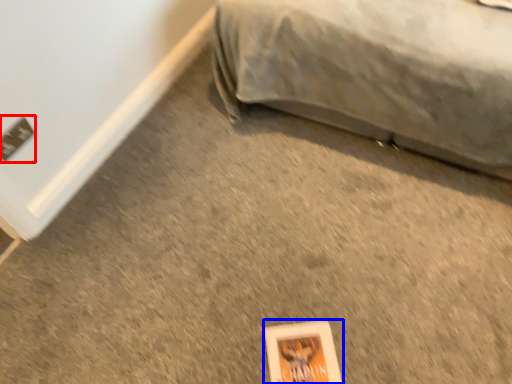
Question: Which of the following is the farthest to the observer, electric outlet (highlighted by a red box) or paperback book (highlighted by a blue box)?

Choices:
 (A) electric outlet
 (B) paperback book

Answer: (A)